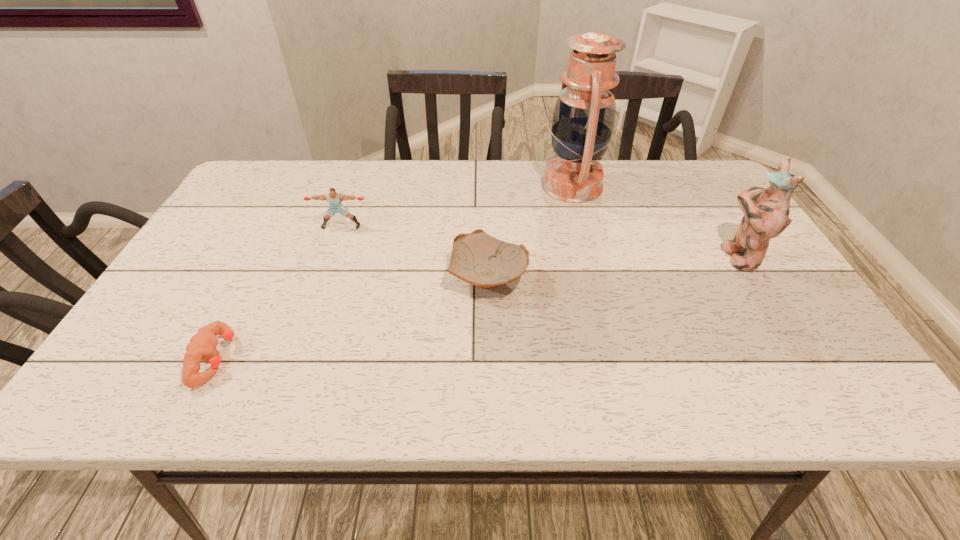
Select which object appears as the fourth closest to the rightmost object. Please provide its 2D coordinates. Your answer should be formatted as a tuple, i.e. [(x, y)], where the tuple contains the x and y coordinates of a point satisfying the conditions above.

[(202, 346)]

The image size is (960, 540). I want to click on object that is the fourth closest to the figurine, so click(202, 346).

The width and height of the screenshot is (960, 540). I want to click on free space that satisfies the following two spatial constraints: 1. on the front-facing side of the farther puncher; 2. on the right side of the second shortest object, so click(x=324, y=276).

The image size is (960, 540). In order to click on blank area in the image that satisfies the following two spatial constraints: 1. on the front-facing side of the second farthest object; 2. on the right side of the second shortest object in this screenshot , I will do `click(324, 276)`.